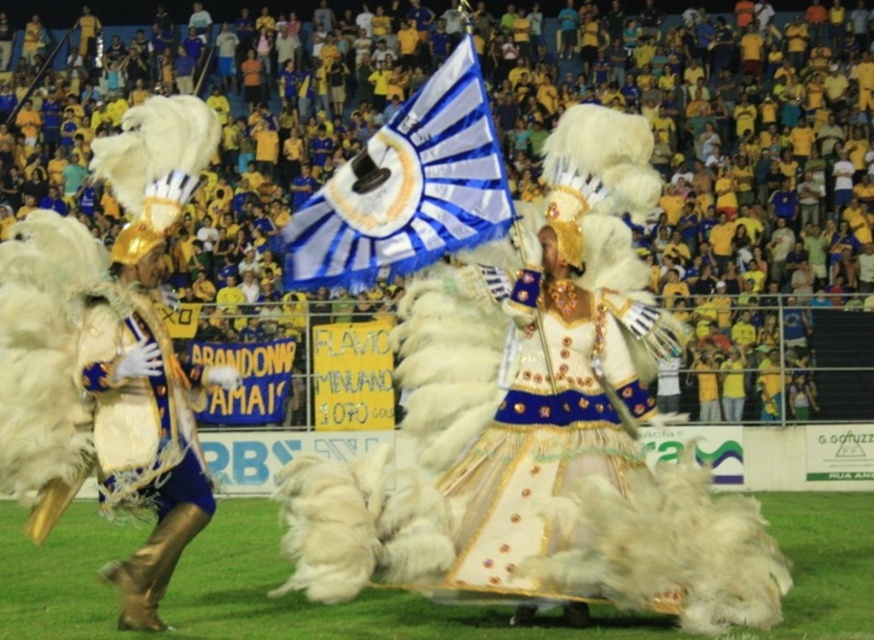
Can you confirm if yellow fabric crowd at upper center is positioned to the right of blue and white fabric flag at center?

In fact, yellow fabric crowd at upper center is to the left of blue and white fabric flag at center.

Is yellow fabric crowd at upper center closer to camera compared to blue and white fabric flag at center?

No, it is behind blue and white fabric flag at center.

Where is `yellow fabric crowd at upper center`? The image size is (874, 640). yellow fabric crowd at upper center is located at coordinates [x=725, y=184].

Where is `yellow fabric crowd at upper center`? yellow fabric crowd at upper center is located at coordinates (725, 184).